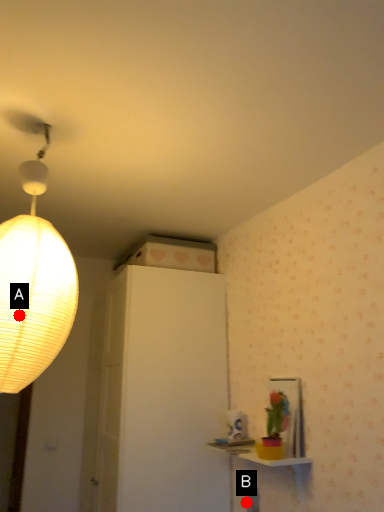
Question: Two points are circled on the image, labeled by A and B beside each circle. Which point is closer to the camera?

Choices:
 (A) A is closer
 (B) B is closer

Answer: (A)